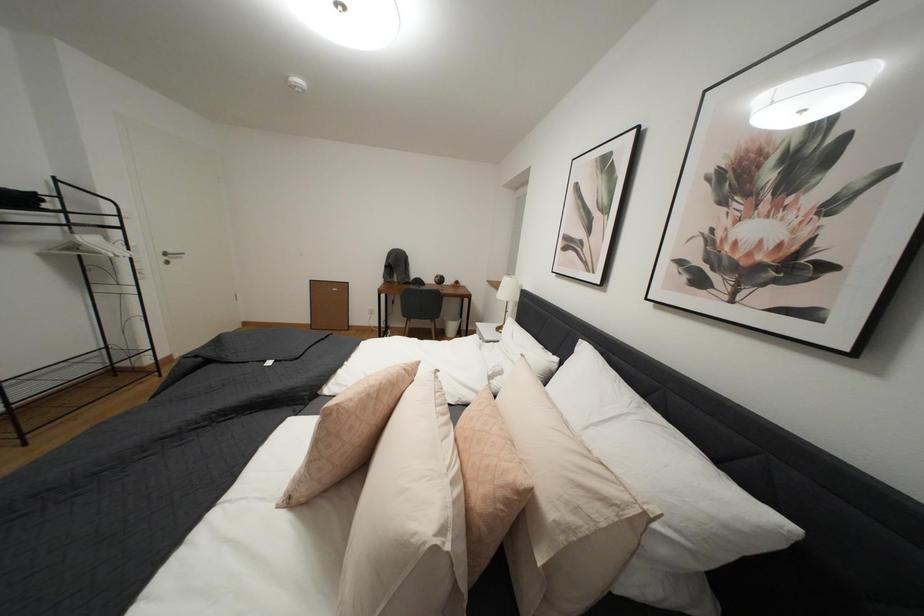
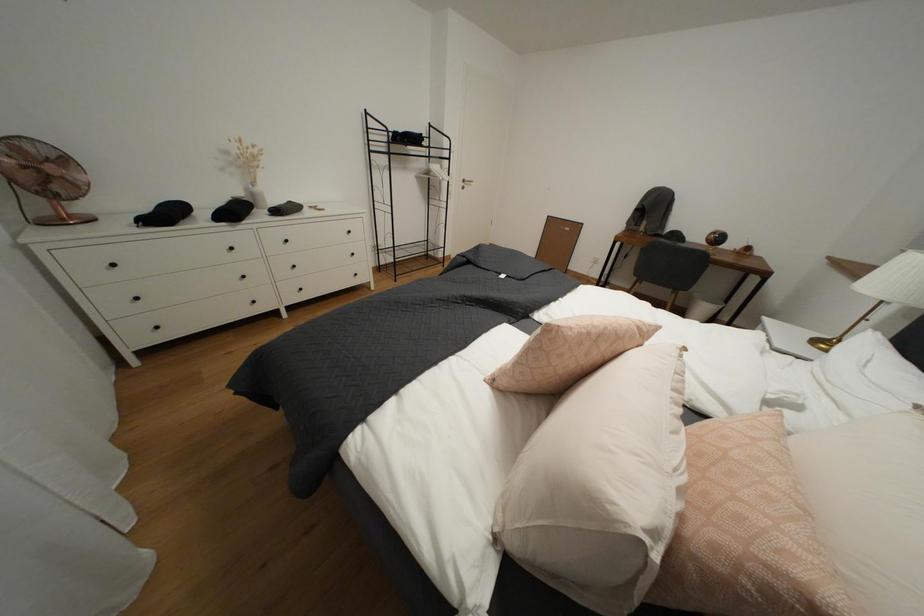
First-person continuous shooting, in which direction is the camera rotating?

The camera's rotation is toward left-down.